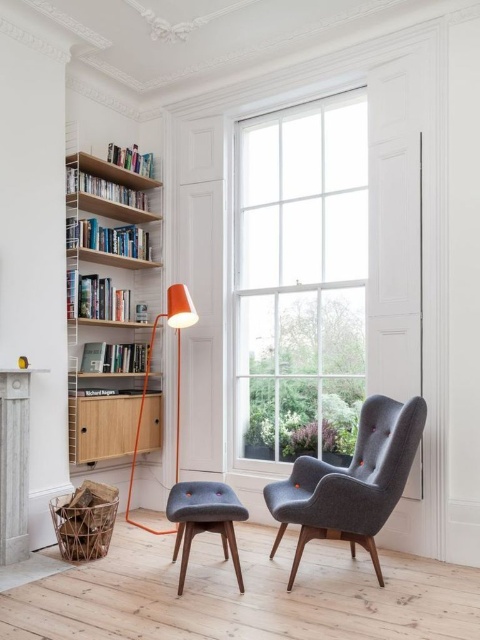
Can you confirm if wooden bookshelf at left is taller than dark gray fabric armchair at right?

Yes.

Does wooden bookshelf at left appear on the left side of dark gray fabric armchair at right?

Yes, wooden bookshelf at left is to the left of dark gray fabric armchair at right.

What do you see at coordinates (108, 301) in the screenshot?
I see `wooden bookshelf at left` at bounding box center [108, 301].

Image resolution: width=480 pixels, height=640 pixels. Identify the location of wooden bookshelf at left. (108, 301).

Looking at this image, does wooden bookshelf at left lie in front of dark gray fabric stool at center?

No.

Who is higher up, wooden bookshelf at left or dark gray fabric stool at center?

wooden bookshelf at left

Is point (73, 253) less distant than point (211, 531)?

No, it is behind (211, 531).

Find the location of a particular element. This screenshot has width=480, height=640. wooden bookshelf at left is located at coordinates (108, 301).

Consider the image. Does clear glass window at center appear under white painted wood fireplace at lower left?

Actually, clear glass window at center is above white painted wood fireplace at lower left.

This screenshot has height=640, width=480. Find the location of `clear glass window at center`. clear glass window at center is located at coordinates (300, 280).